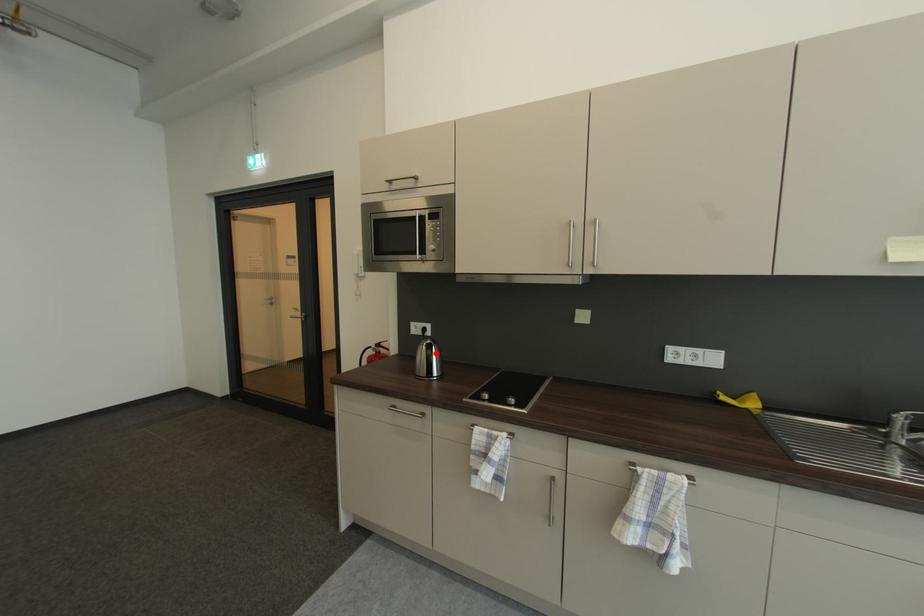
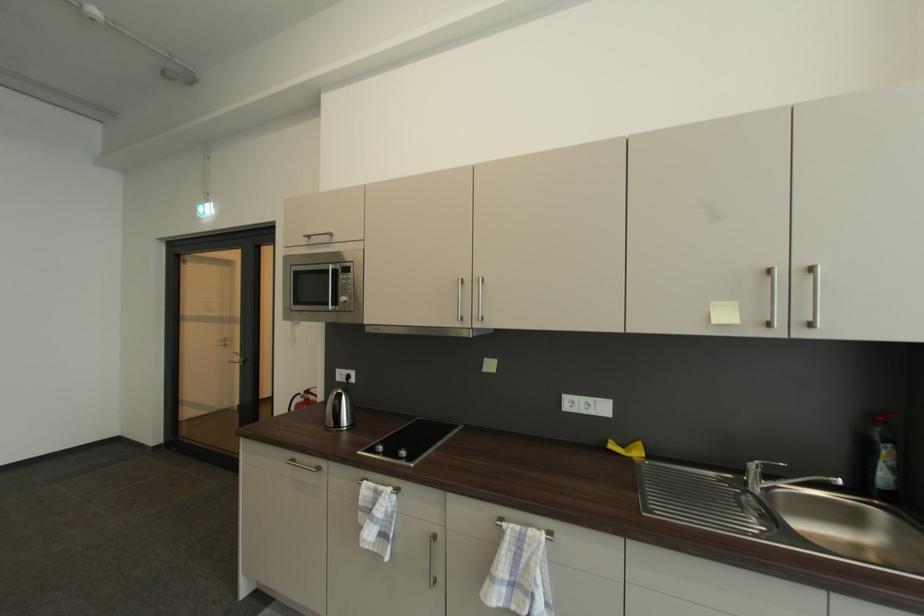
The point at the highlighted location is marked in the first image. Where is the corresponding point in the second image?

(344, 403)